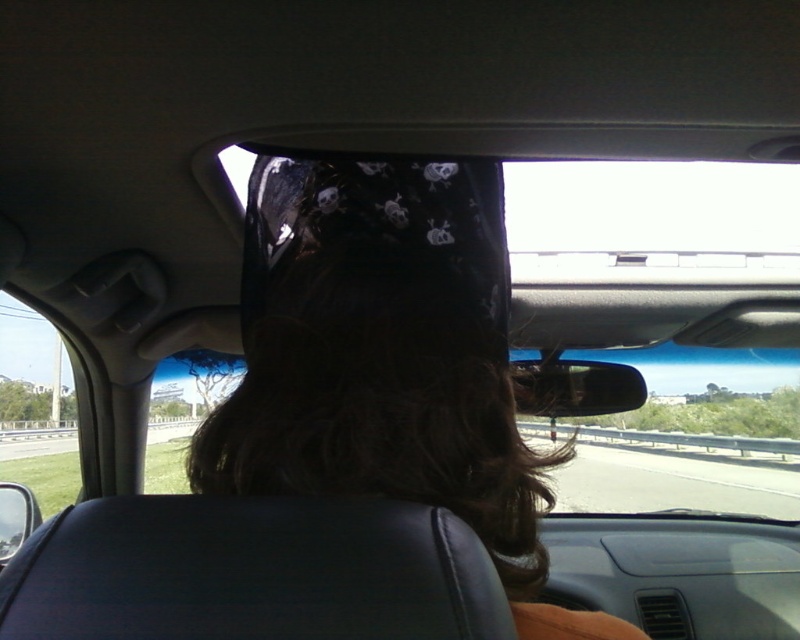
In the scene shown: Is black fabric bandana at center to the left of glossy plastic view mirror at center from the viewer's perspective?

Yes, black fabric bandana at center is to the left of glossy plastic view mirror at center.

Is black fabric bandana at center wider than glossy plastic view mirror at center?

Yes.

Which is behind, point (460, 348) or point (570, 362)?

Point (570, 362)

Locate an element on the screen. black fabric bandana at center is located at coordinates (388, 362).

Based on the photo, does black fabric bandana at center appear over black leather headrest at center?

Indeed, black fabric bandana at center is positioned over black leather headrest at center.

Between black fabric bandana at center and black leather headrest at center, which one has more height?

With more height is black fabric bandana at center.

Which is behind, point (440, 292) or point (214, 554)?

The point (440, 292) is behind.

This screenshot has width=800, height=640. In order to click on black fabric bandana at center in this screenshot , I will do `click(388, 362)`.

Does black leather headrest at center have a lesser width compared to glossy plastic view mirror at center?

In fact, black leather headrest at center might be wider than glossy plastic view mirror at center.

Based on the photo, between black leather headrest at center and glossy plastic view mirror at center, which one appears on the right side from the viewer's perspective?

Positioned to the right is glossy plastic view mirror at center.

This screenshot has height=640, width=800. In order to click on black leather headrest at center in this screenshot , I will do `click(252, 572)`.